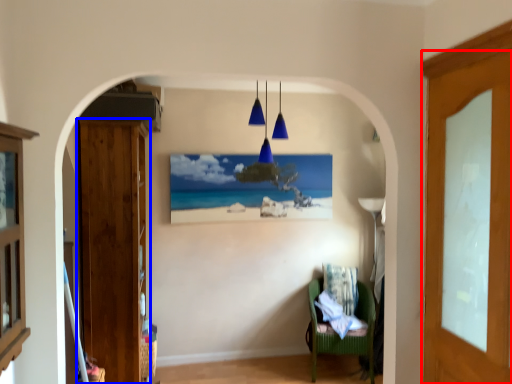
Question: Which of the following is the closest to the observer, door (highlighted by a red box) or door (highlighted by a blue box)?

Choices:
 (A) door
 (B) door

Answer: (A)